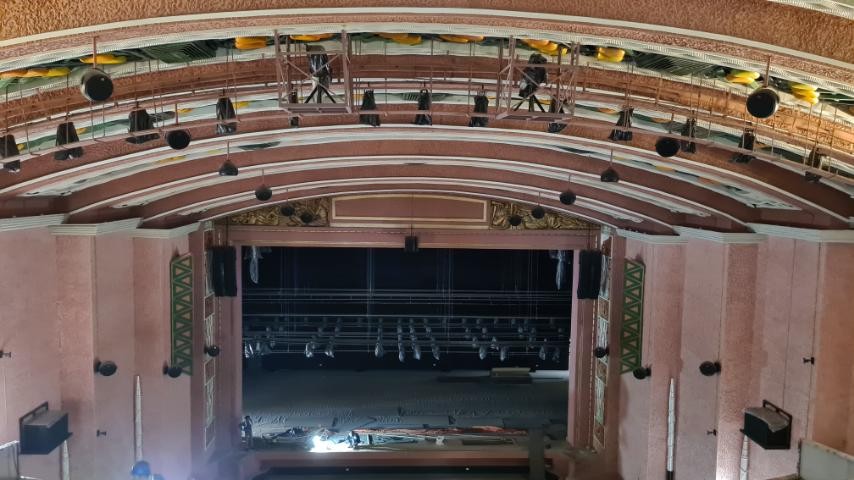
Find the location of a particular element. This screenshot has height=480, width=854. green and gold painted decorations is located at coordinates (634, 270), (178, 262).